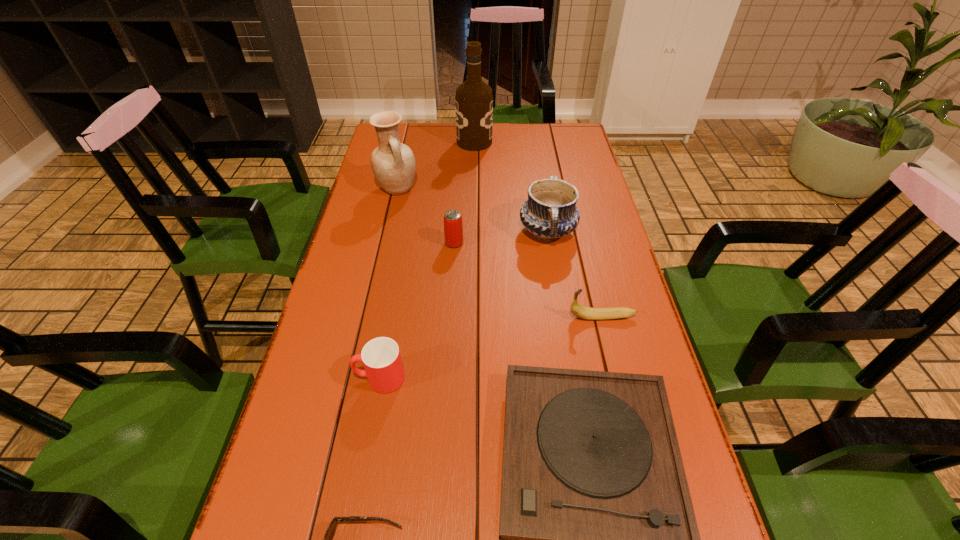
You are a GUI agent. You are given a task and a screenshot of the screen. Output one action in this format:
    pyautogui.click(x=<x>, y=<y>)
    Task: Click on the vacant space located 0.200m on the front of the left pottery
    
    Given the screenshot: What is the action you would take?
    pyautogui.click(x=385, y=243)

The height and width of the screenshot is (540, 960). In order to click on vacant space positioned on the left of the nearer pottery in this screenshot , I will do `click(450, 231)`.

Locate an element on the screen. The width and height of the screenshot is (960, 540). free space located on the front of the beer can is located at coordinates (453, 261).

At what (x,y) coordinates should I click in order to perform the action: click on free space located 0.160m at the stem of the fourth nearest object. Please return your answer as a coordinate pair (x, y). The width and height of the screenshot is (960, 540). Looking at the image, I should click on (505, 317).

Locate an element on the screen. This screenshot has width=960, height=540. free space located at the stem of the fourth nearest object is located at coordinates (438, 317).

Identify the location of free point located 0.110m at the stem of the fourth nearest object. (525, 317).

The width and height of the screenshot is (960, 540). Identify the location of free space located 0.120m on the side of the cup with the handle. (302, 378).

Find the location of a particular element. vacant region located 0.050m on the side of the cup with the handle is located at coordinates (333, 378).

Locate an element on the screen. free space located on the side of the cup with the handle is located at coordinates 320,378.

This screenshot has width=960, height=540. Find the location of `object present at the far edge`. object present at the far edge is located at coordinates (474, 101).